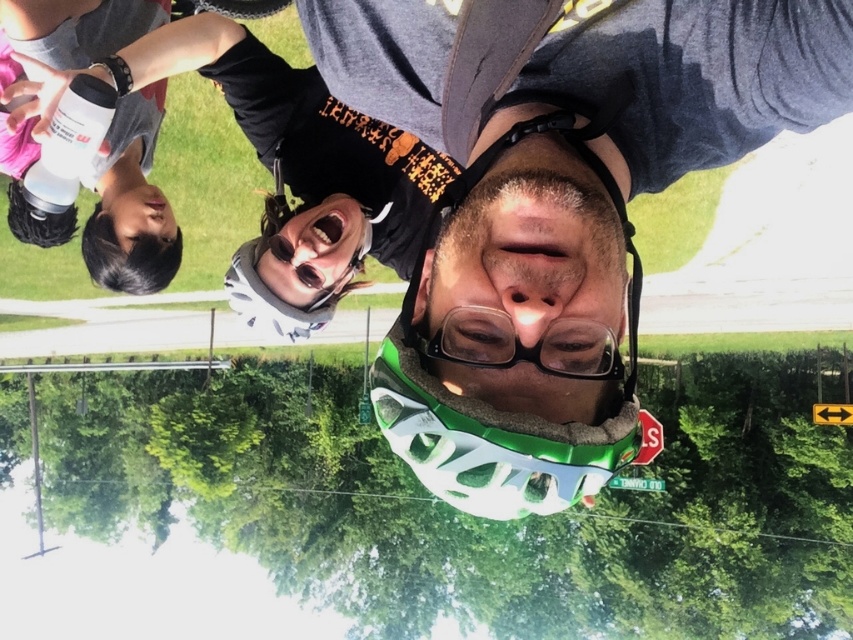
Can you confirm if white matte water bottle at upper left is smaller than transparent plastic goggles at center?

Incorrect, white matte water bottle at upper left is not smaller in size than transparent plastic goggles at center.

Does white matte water bottle at upper left appear under transparent plastic goggles at center?

Actually, white matte water bottle at upper left is above transparent plastic goggles at center.

Which is behind, point (21, 221) or point (570, 337)?

Point (21, 221)

This screenshot has height=640, width=853. Find the location of `white matte water bottle at upper left`. white matte water bottle at upper left is located at coordinates (131, 204).

Is transparent plastic goggles at center smaller than white matte bottle at upper left?

Indeed, transparent plastic goggles at center has a smaller size compared to white matte bottle at upper left.

The image size is (853, 640). I want to click on transparent plastic goggles at center, so click(x=525, y=346).

Who is more forward, (585, 349) or (90, 147)?

Point (585, 349) is more forward.

Identify the location of transparent plastic goggles at center. This screenshot has width=853, height=640. (525, 346).

Does white matte water bottle at upper left have a lesser width compared to white matte bottle at upper left?

Incorrect, white matte water bottle at upper left's width is not less than white matte bottle at upper left's.

Between point (91, 56) and point (91, 161), which one is positioned in front?

Point (91, 161)

This screenshot has height=640, width=853. Describe the element at coordinates (131, 204) in the screenshot. I see `white matte water bottle at upper left` at that location.

Where is `white matte water bottle at upper left`? white matte water bottle at upper left is located at coordinates (131, 204).